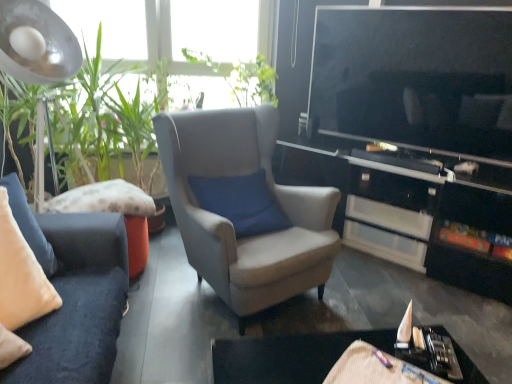
Question: Would you say green leafy plant at left is outside velvet beige pillow at left?

Choices:
 (A) yes
 (B) no

Answer: (A)

Question: Can you confirm if green leafy plant at left is wider than velvet beige pillow at left?

Choices:
 (A) no
 (B) yes

Answer: (B)

Question: From the image's perspective, is green leafy plant at left located above velvet beige pillow at left?

Choices:
 (A) no
 (B) yes

Answer: (B)

Question: From the image's perspective, is green leafy plant at left below velvet beige pillow at left?

Choices:
 (A) yes
 (B) no

Answer: (B)

Question: Considering the relative positions of green leafy plant at left and velvet beige pillow at left in the image provided, is green leafy plant at left to the right of velvet beige pillow at left from the viewer's perspective?

Choices:
 (A) no
 (B) yes

Answer: (A)

Question: From their relative heights in the image, would you say suede-like beige armchair at center is taller or shorter than green leafy plant at left?

Choices:
 (A) tall
 (B) short

Answer: (B)

Question: Based on their positions, is suede-like beige armchair at center located to the left or right of green leafy plant at left?

Choices:
 (A) left
 (B) right

Answer: (B)

Question: In terms of size, does suede-like beige armchair at center appear bigger or smaller than green leafy plant at left?

Choices:
 (A) big
 (B) small

Answer: (B)

Question: Is suede-like beige armchair at center wider or thinner than green leafy plant at left?

Choices:
 (A) wide
 (B) thin

Answer: (A)

Question: Is point (342, 185) positioned closer to the camera than point (282, 337)?

Choices:
 (A) farther
 (B) closer

Answer: (A)

Question: In terms of size, does black glossy cabinet at center appear bigger or smaller than black glossy table at lower right?

Choices:
 (A) small
 (B) big

Answer: (B)

Question: Considering the positions of black glossy cabinet at center and black glossy table at lower right in the image, is black glossy cabinet at center taller or shorter than black glossy table at lower right?

Choices:
 (A) tall
 (B) short

Answer: (A)

Question: In the image, is black glossy cabinet at center positioned in front of or behind black glossy table at lower right?

Choices:
 (A) front
 (B) behind

Answer: (B)

Question: In the image, is green leafy plant at left positioned in front of or behind green leafy plant at upper center?

Choices:
 (A) behind
 (B) front

Answer: (B)

Question: From the image's perspective, relative to green leafy plant at upper center, is green leafy plant at left above or below?

Choices:
 (A) above
 (B) below

Answer: (B)